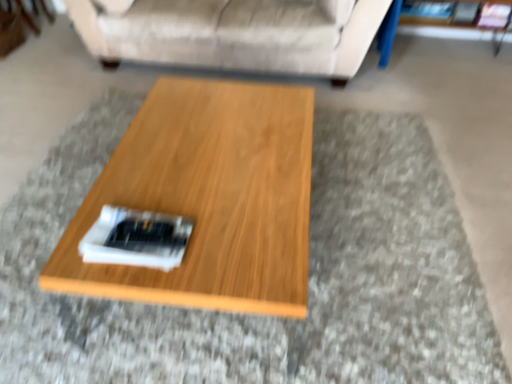
Question: Is wooden coffee table at center at the left side of beige fabric couch at upper center?

Choices:
 (A) no
 (B) yes

Answer: (A)

Question: Does wooden coffee table at center lie in front of beige fabric couch at upper center?

Choices:
 (A) no
 (B) yes

Answer: (B)

Question: From a real-world perspective, is wooden coffee table at center positioned over beige fabric couch at upper center based on gravity?

Choices:
 (A) yes
 (B) no

Answer: (B)

Question: Does wooden coffee table at center have a larger size compared to beige fabric couch at upper center?

Choices:
 (A) yes
 (B) no

Answer: (B)

Question: Is wooden coffee table at center further to camera compared to beige fabric couch at upper center?

Choices:
 (A) yes
 (B) no

Answer: (B)

Question: From a real-world perspective, is wooden coffee table at center positioned under beige fabric couch at upper center based on gravity?

Choices:
 (A) no
 (B) yes

Answer: (B)

Question: Considering the relative sizes of beige fabric couch at upper center and wooden coffee table at center in the image provided, is beige fabric couch at upper center bigger than wooden coffee table at center?

Choices:
 (A) yes
 (B) no

Answer: (A)

Question: Is the depth of beige fabric couch at upper center greater than that of wooden coffee table at center?

Choices:
 (A) yes
 (B) no

Answer: (A)

Question: Is wooden coffee table at center surrounded by beige fabric couch at upper center?

Choices:
 (A) yes
 (B) no

Answer: (B)

Question: Is beige fabric couch at upper center placed right next to wooden coffee table at center?

Choices:
 (A) yes
 (B) no

Answer: (B)

Question: From the image's perspective, does beige fabric couch at upper center appear higher than wooden coffee table at center?

Choices:
 (A) yes
 (B) no

Answer: (A)

Question: Is beige fabric couch at upper center facing away from wooden coffee table at center?

Choices:
 (A) yes
 (B) no

Answer: (B)

Question: Would you say wooden coffee table at center is to the left or to the right of beige fabric couch at upper center in the picture?

Choices:
 (A) right
 (B) left

Answer: (A)